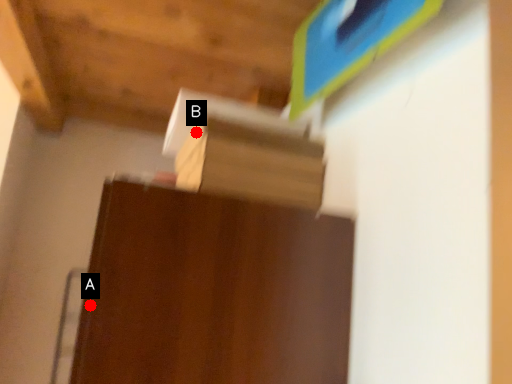
Question: Two points are circled on the image, labeled by A and B beside each circle. Which point is closer to the camera?

Choices:
 (A) A is closer
 (B) B is closer

Answer: (A)